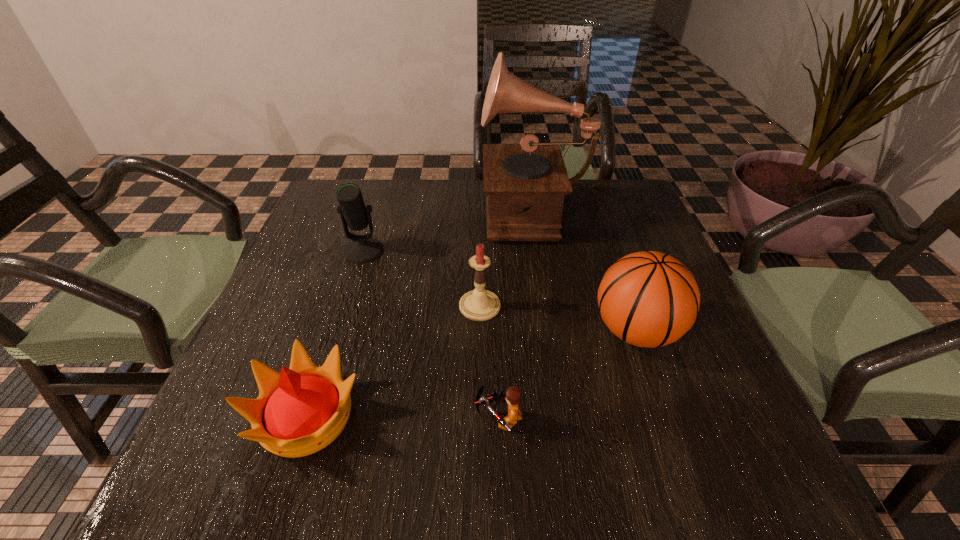
Find the location of a particular element. This screenshot has height=540, width=960. free spot located 0.150m on the left of the basketball is located at coordinates (517, 331).

Where is `vacant space located on the left of the candle`? vacant space located on the left of the candle is located at coordinates [385, 306].

Identify the location of vacant space situated 0.390m on the back of the fifth tallest object. The image size is (960, 540). (362, 243).

Find the location of `free space located 0.090m holding a crossbow in the hands of the shortest object`. free space located 0.090m holding a crossbow in the hands of the shortest object is located at coordinates (421, 418).

Locate an element on the screen. The image size is (960, 540). free spot located 0.180m holding a crossbow in the hands of the shortest object is located at coordinates (370, 418).

Find the location of a particular element. Image resolution: width=960 pixels, height=540 pixels. free spot located holding a crossbow in the hands of the shortest object is located at coordinates (270, 418).

Identify the location of object that is at the far edge. This screenshot has width=960, height=540. (525, 184).

Locate an element on the screen. The width and height of the screenshot is (960, 540). crown that is positioned at the near edge is located at coordinates [301, 410].

You are a GUI agent. You are given a task and a screenshot of the screen. Output one action in this format:
    pyautogui.click(x=<x>, y=<y>)
    Task: Click on the Lego located in the near edge section of the desktop
    
    Given the screenshot: What is the action you would take?
    pyautogui.click(x=512, y=397)

Identify the location of microphone located at the left edge. (354, 214).